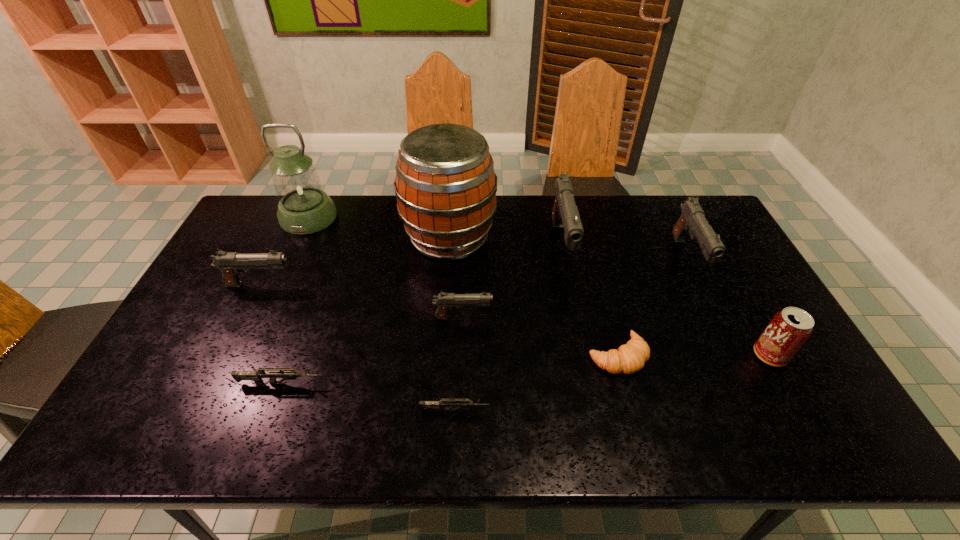
The image size is (960, 540). What are the coordinates of `lantern that is at the left edge` in the screenshot? It's located at (304, 208).

Find the location of `gun that is at the left edge`. gun that is at the left edge is located at coordinates (231, 264).

At what (x,y) coordinates should I click in order to perform the action: click on gun located in the right edge section of the desktop. Please return your answer as a coordinate pair (x, y). The image size is (960, 540). Looking at the image, I should click on (692, 220).

Find the location of a particular element. This screenshot has height=540, width=960. soda can located in the right edge section of the desktop is located at coordinates (789, 329).

Locate an element on the screen. This screenshot has width=960, height=540. object that is at the far left corner is located at coordinates (304, 208).

Find the location of a particular element. This screenshot has width=960, height=540. object that is at the far right corner is located at coordinates (692, 220).

Image resolution: width=960 pixels, height=540 pixels. In the image, there is a desktop. Find the location of `vacant space at the far edge`. vacant space at the far edge is located at coordinates (367, 220).

Locate an element on the screen. blank space at the near edge of the desktop is located at coordinates 468,417.

I want to click on free point at the left edge, so click(x=180, y=410).

Locate an element on the screen. The height and width of the screenshot is (540, 960). free space at the right edge is located at coordinates (715, 301).